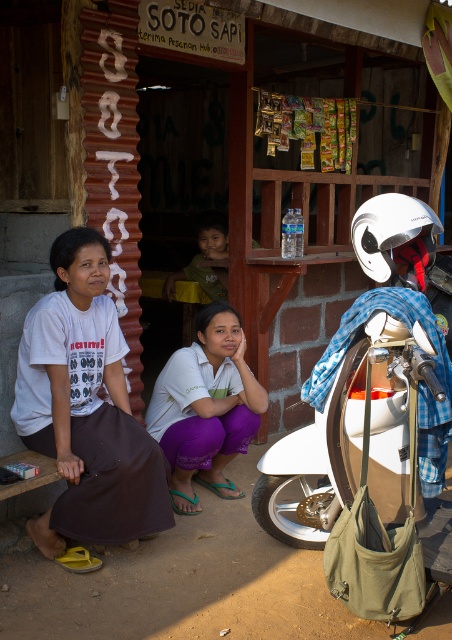
Question: Does purple fabric skirt at lower left appear under white matte shirt at center?

Choices:
 (A) no
 (B) yes

Answer: (A)

Question: Which of the following is the closest to the observer?

Choices:
 (A) (164, 284)
 (B) (117, 332)
 (C) (343, 435)

Answer: (C)

Question: Does white matte motorcycle at center have a larger size compared to green fabric shirt at upper center?

Choices:
 (A) no
 (B) yes

Answer: (B)

Question: Which of the following is the farthest from the observer?

Choices:
 (A) (37, 374)
 (B) (222, 236)
 (C) (220, 413)
 (D) (371, 218)

Answer: (B)

Question: Among these points, which one is farthest from the camera?

Choices:
 (A) (170, 280)
 (B) (352, 440)
 (C) (113, 388)
 (D) (211, 314)

Answer: (A)

Question: Can you confirm if purple fabric skirt at lower left is wider than white matte shirt at center?

Choices:
 (A) no
 (B) yes

Answer: (B)